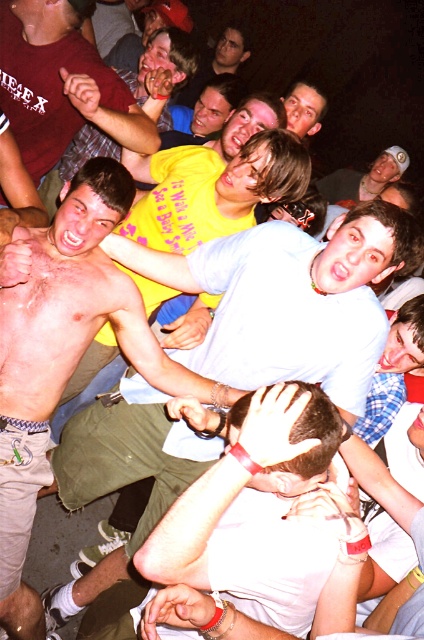
Question: Among these objects, which one is farthest from the camera?

Choices:
 (A) matte yellow t-shirt at center
 (B) white matte shirt at center
 (C) matte yellow shirt at upper left

Answer: (A)

Question: Estimate the real-world distances between objects in this image. Which object is farther from the matte yellow shirt at upper left?

Choices:
 (A) white matte shirt at center
 (B) matte yellow t-shirt at center

Answer: (B)

Question: Is the position of matte yellow shirt at upper left more distant than that of matte yellow t-shirt at center?

Choices:
 (A) yes
 (B) no

Answer: (B)

Question: Does white matte shirt at center have a larger size compared to matte yellow shirt at upper left?

Choices:
 (A) yes
 (B) no

Answer: (B)

Question: Where is matte yellow shirt at upper left located in relation to matte yellow t-shirt at center in the image?

Choices:
 (A) below
 (B) above

Answer: (A)

Question: Which object appears farthest from the camera in this image?

Choices:
 (A) white matte shirt at center
 (B) matte yellow t-shirt at center
 (C) matte yellow shirt at upper left

Answer: (B)